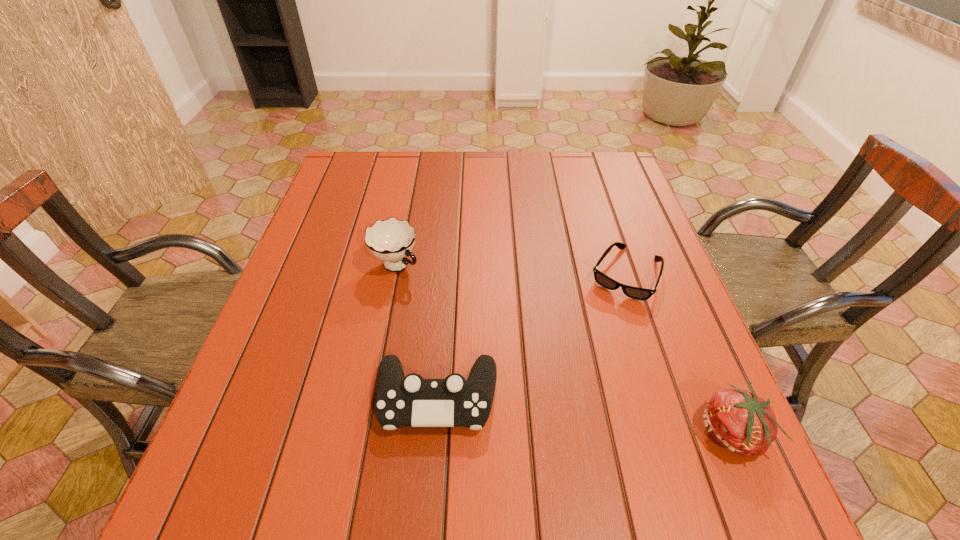
Locate an element on the screen. The height and width of the screenshot is (540, 960). free region located 0.190m on the front-facing side of the shortest object is located at coordinates [583, 361].

This screenshot has height=540, width=960. In order to click on control that is at the near edge in this screenshot , I will do `click(401, 401)`.

You are a GUI agent. You are given a task and a screenshot of the screen. Output one action in this format:
    pyautogui.click(x=<x>, y=<y>)
    Task: Click on the tomato that is at the near edge
    This screenshot has height=540, width=960.
    Given the screenshot: What is the action you would take?
    pyautogui.click(x=742, y=422)

Identify the location of tomato at the right edge. (742, 422).

Where is `sunglasses that is at the right edge`? sunglasses that is at the right edge is located at coordinates (637, 293).

At what (x,y) coordinates should I click in order to perform the action: click on object situated at the near right corner. Please return your answer as a coordinate pair (x, y). Image resolution: width=960 pixels, height=540 pixels. Looking at the image, I should click on (742, 422).

Find the location of `free region at the far edge`. free region at the far edge is located at coordinates click(566, 168).

Where is `free space at the near edge of the desktop`? Image resolution: width=960 pixels, height=540 pixels. free space at the near edge of the desktop is located at coordinates (365, 416).

Find the location of a particular element. free space at the left edge of the desktop is located at coordinates (283, 394).

Image resolution: width=960 pixels, height=540 pixels. What are the coordinates of `vacant point at the right edge` in the screenshot? It's located at (658, 387).